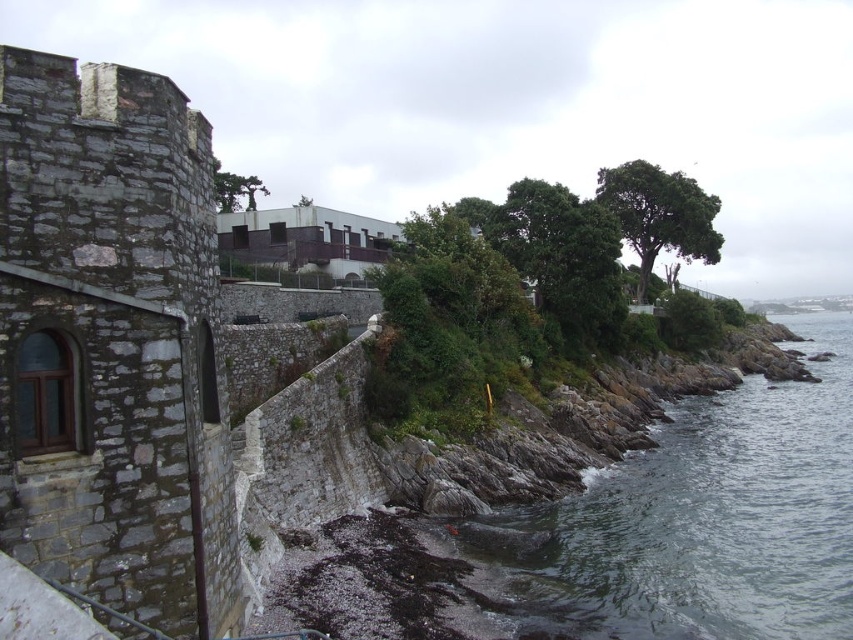
Is clear water at lower right further to the viewer compared to green matte tree at upper center?

Yes, it is.

Can you confirm if clear water at lower right is wider than green matte tree at upper center?

No.

Is point (793, 468) positioned after point (218, 202)?

That is False.

Identify the location of clear water at lower right. This screenshot has width=853, height=640. (695, 522).

Is clear water at lower right bigger than green leafy tree at upper right?

Incorrect, clear water at lower right is not larger than green leafy tree at upper right.

Is point (753, 435) positioned behind point (646, 209)?

No.

Does point (776, 529) come farther from viewer compared to point (647, 220)?

That is False.

Locate an element on the screen. The height and width of the screenshot is (640, 853). clear water at lower right is located at coordinates (695, 522).

Who is more distant from viewer, [175,212] or [221,173]?

Point [221,173]

Does gray stone wall at left have a lesser width compared to green matte tree at upper center?

Yes.

The width and height of the screenshot is (853, 640). What do you see at coordinates (120, 346) in the screenshot?
I see `gray stone wall at left` at bounding box center [120, 346].

You are a GUI agent. You are given a task and a screenshot of the screen. Output one action in this format:
    pyautogui.click(x=<x>, y=<y>)
    Task: Click on the gray stone wall at left
    Image resolution: width=853 pixels, height=640 pixels.
    Given the screenshot: What is the action you would take?
    pyautogui.click(x=120, y=346)